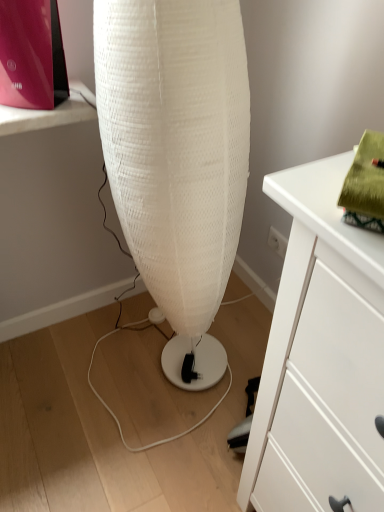
Image resolution: width=384 pixels, height=512 pixels. I want to click on white mesh lamp at center, so click(177, 156).

Describe the element at coordinates (177, 156) in the screenshot. I see `white mesh lamp at center` at that location.

Where is `white mesh lamp at center`? white mesh lamp at center is located at coordinates (177, 156).